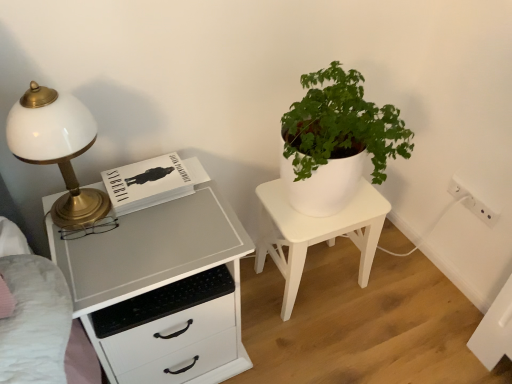
In order to face white glossy lamp at left, should I rotate leftwards or rightwards?

To align with it, rotate left about 24.333°.

Identify the location of white glossy chest of drawers at left. This screenshot has width=512, height=384. pyautogui.click(x=162, y=291).

Where is `white matte/porcelain nightstand at center`? white matte/porcelain nightstand at center is located at coordinates (315, 233).

The width and height of the screenshot is (512, 384). Identify the location of white glossy lamp at left. (57, 149).

Can you confirm if white plastic electric outlet at lower right is positioned to the right of white glossy chest of drawers at left?

Indeed, white plastic electric outlet at lower right is positioned on the right side of white glossy chest of drawers at left.

Is white plastic electric outlet at lower right aimed at white glossy chest of drawers at left?

Yes, white plastic electric outlet at lower right faces towards white glossy chest of drawers at left.

How far apart are white plastic electric outlet at lower right and white glossy chest of drawers at left?

white plastic electric outlet at lower right and white glossy chest of drawers at left are 1.12 meters apart from each other.

Considering the sizes of objects white plastic electric outlet at lower right and white glossy chest of drawers at left in the image provided, who is thinner, white plastic electric outlet at lower right or white glossy chest of drawers at left?

Thinner between the two is white plastic electric outlet at lower right.

In the image, is white glossy chest of drawers at left positioned in front of or behind white plastic electric outlet at lower right?

In the image, white glossy chest of drawers at left appears in front of white plastic electric outlet at lower right.

Where is `chest of drawers on the left of white plastic electric outlet at lower right`? This screenshot has height=384, width=512. chest of drawers on the left of white plastic electric outlet at lower right is located at coordinates (162, 291).

Is white glossy chest of drawers at left turned away from white plastic electric outlet at lower right?

No, white plastic electric outlet at lower right is not at the back of white glossy chest of drawers at left.

Does white glossy chest of drawers at left appear on the left side of white plastic electric outlet at lower right?

Indeed, white glossy chest of drawers at left is positioned on the left side of white plastic electric outlet at lower right.

Would you consider white glossy chest of drawers at left to be distant from white matte/porcelain nightstand at center?

No, white glossy chest of drawers at left is in close proximity to white matte/porcelain nightstand at center.

Which of these two, white glossy chest of drawers at left or white matte/porcelain nightstand at center, is bigger?

Bigger between the two is white glossy chest of drawers at left.

In the image, there is a white glossy chest of drawers at left. Where is `nightstand below it (from a real-world perspective)`? Image resolution: width=512 pixels, height=384 pixels. nightstand below it (from a real-world perspective) is located at coordinates (315, 233).

Is white glossy chest of drawers at left oriented towards white matte/porcelain nightstand at center?

No, white glossy chest of drawers at left does not turn towards white matte/porcelain nightstand at center.

From the image's perspective, who appears lower, white glossy lamp at left or white glossy chest of drawers at left?

From the image's view, white glossy chest of drawers at left is below.

Which of these two, white glossy lamp at left or white glossy chest of drawers at left, stands shorter?

With less height is white glossy lamp at left.

Is white glossy lamp at left turned away from white glossy chest of drawers at left?

That's not correct — white glossy lamp at left is not looking away from white glossy chest of drawers at left.

Can you confirm if white glossy lamp at left is positioned to the left of white glossy chest of drawers at left?

Indeed, white glossy lamp at left is positioned on the left side of white glossy chest of drawers at left.

Who is shorter, white glossy lamp at left or white plastic electric outlet at lower right?

white plastic electric outlet at lower right is shorter.

Would you consider white glossy lamp at left to be distant from white plastic electric outlet at lower right?

white glossy lamp at left is far away from white plastic electric outlet at lower right.

In the scene shown: How many degrees apart are the facing directions of white glossy lamp at left and white plastic electric outlet at lower right?

The facing directions of white glossy lamp at left and white plastic electric outlet at lower right are 89.9 degrees apart.

This screenshot has width=512, height=384. Find the location of `electric outlet behind the white glossy lamp at left`. electric outlet behind the white glossy lamp at left is located at coordinates (472, 203).

Between white glossy chest of drawers at left and white glossy lamp at left, which one has smaller width?

With smaller width is white glossy lamp at left.

From the image's perspective, is white glossy chest of drawers at left under white glossy lamp at left?

Correct, white glossy chest of drawers at left appears lower than white glossy lamp at left in the image.

Is white glossy chest of drawers at left taller than white glossy lamp at left?

Indeed, white glossy chest of drawers at left has a greater height compared to white glossy lamp at left.

Which point is more distant from viewer, (189,336) or (42,93)?

Positioned behind is point (189,336).

Is white matte/porcelain nightstand at center touching white glossy lamp at left?

white matte/porcelain nightstand at center and white glossy lamp at left are clearly separated.

Which object is closer to the camera, white matte/porcelain nightstand at center or white glossy lamp at left?

white glossy lamp at left is closer to the camera.

In terms of height, does white matte/porcelain nightstand at center look taller or shorter compared to white glossy lamp at left?

Considering their sizes, white matte/porcelain nightstand at center has more height than white glossy lamp at left.

From the image's perspective, is white matte/porcelain nightstand at center on top of white glossy lamp at left?

No, from the image's perspective, white matte/porcelain nightstand at center is not on top of white glossy lamp at left.

Find the location of a particular element. electric outlet that is above the white glossy chest of drawers at left (from the image's perspective) is located at coordinates (472, 203).

Find the location of a particular element. chest of drawers lying on the left of white plastic electric outlet at lower right is located at coordinates (162, 291).

Looking at the image, which one is located closer to white glossy chest of drawers at left, white glossy lamp at left or white matte/porcelain nightstand at center?

The object closer to white glossy chest of drawers at left is white glossy lamp at left.

Estimate the real-world distances between objects in this image. Which object is further from white glossy chest of drawers at left, white matte/porcelain nightstand at center or white plastic electric outlet at lower right?

white plastic electric outlet at lower right is positioned further to the anchor white glossy chest of drawers at left.

When comparing their distances from white glossy chest of drawers at left, does white plastic electric outlet at lower right or white matte/porcelain nightstand at center seem further?

white plastic electric outlet at lower right.

Looking at the image, which one is located closer to white glossy chest of drawers at left, white plastic electric outlet at lower right or white glossy lamp at left?

white glossy lamp at left lies closer to white glossy chest of drawers at left than the other object.

When comparing their distances from white matte/porcelain nightstand at center, does white plastic electric outlet at lower right or white glossy chest of drawers at left seem closer?

Among the two, white glossy chest of drawers at left is located nearer to white matte/porcelain nightstand at center.

Based on the photo, from the image, which object appears to be nearer to white matte/porcelain nightstand at center, white glossy lamp at left or white plastic electric outlet at lower right?

white plastic electric outlet at lower right is closer to white matte/porcelain nightstand at center.

Looking at the image, which one is located further to white plastic electric outlet at lower right, white glossy lamp at left or white glossy chest of drawers at left?

Among the two, white glossy lamp at left is located further to white plastic electric outlet at lower right.

When comparing their distances from white glossy lamp at left, does white plastic electric outlet at lower right or white matte/porcelain nightstand at center seem closer?

white matte/porcelain nightstand at center lies closer to white glossy lamp at left than the other object.

This screenshot has height=384, width=512. I want to click on nightstand situated between white glossy chest of drawers at left and white plastic electric outlet at lower right from left to right, so click(x=315, y=233).

Where is `chest of drawers between white glossy lamp at left and white matte/porcelain nightstand at center in the horizontal direction`? chest of drawers between white glossy lamp at left and white matte/porcelain nightstand at center in the horizontal direction is located at coordinates (162, 291).

The image size is (512, 384). What are the coordinates of `nightstand between white glossy lamp at left and white plastic electric outlet at lower right from left to right` in the screenshot? It's located at (315, 233).

I want to click on chest of drawers between white glossy lamp at left and white plastic electric outlet at lower right, so (x=162, y=291).